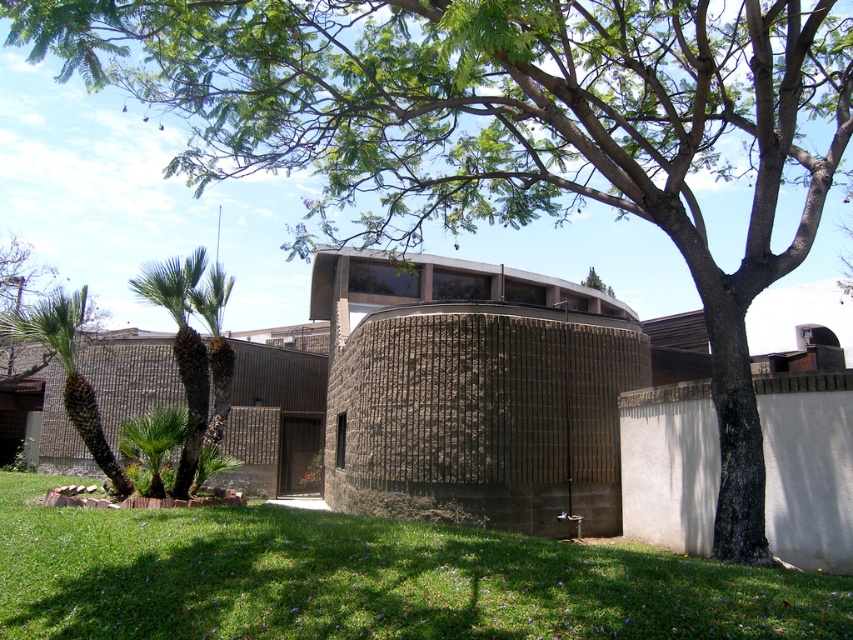
Question: Among these objects, which one is nearest to the camera?

Choices:
 (A) green leafy palm tree at left
 (B) green grass at lower center

Answer: (B)

Question: Is green grass at lower center positioned in front of green leafy palm tree at left?

Choices:
 (A) yes
 (B) no

Answer: (A)

Question: In this image, where is green grass at lower center located relative to green leafy palm tree at left?

Choices:
 (A) right
 (B) left

Answer: (A)

Question: Does green grass at lower center have a larger size compared to green leafy palm tree at left?

Choices:
 (A) yes
 (B) no

Answer: (B)